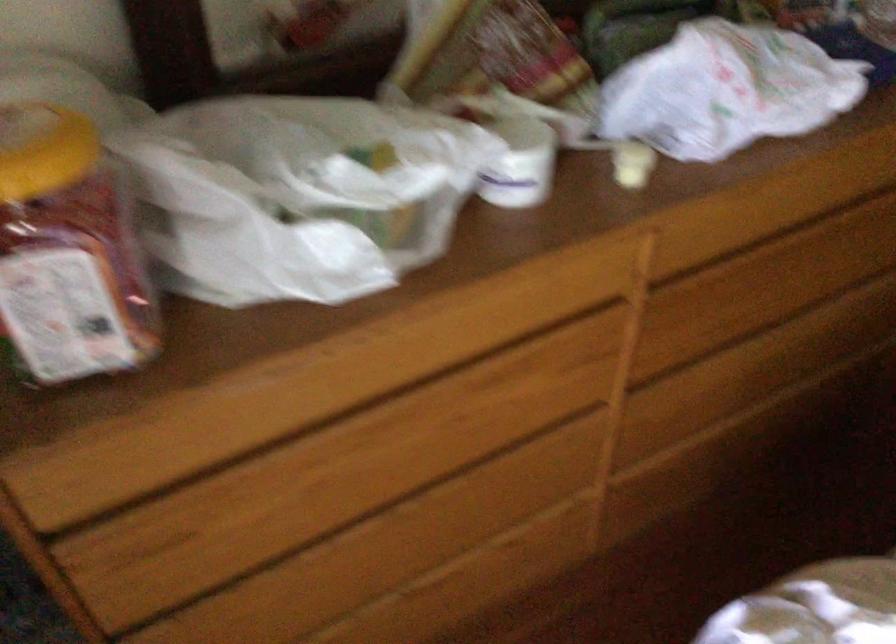
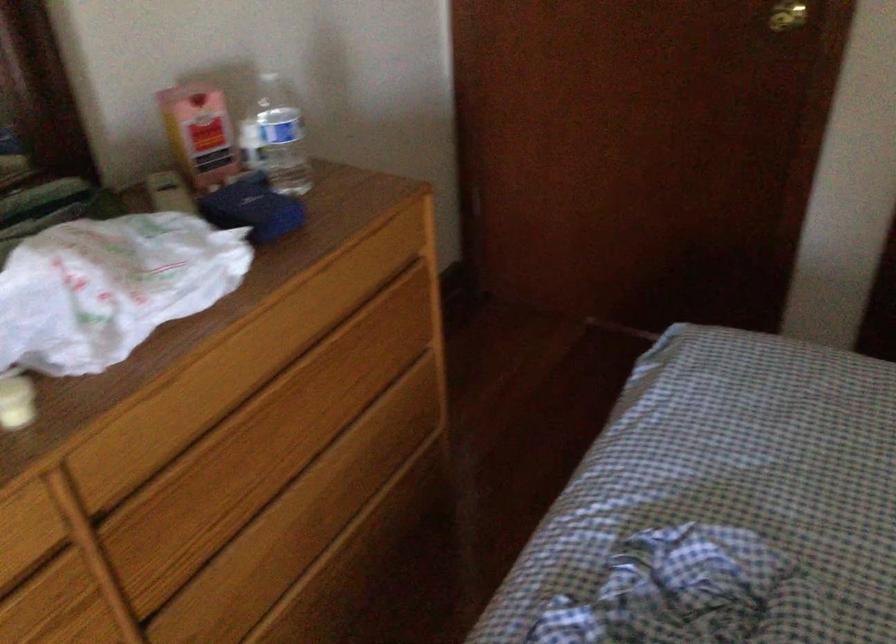
Question: The camera is either moving clockwise (left) or counter-clockwise (right) around the object. The first image is from the beginning of the video and the second image is from the end. Is the camera moving left or right when shooting the video?

Choices:
 (A) Left
 (B) Right

Answer: (A)